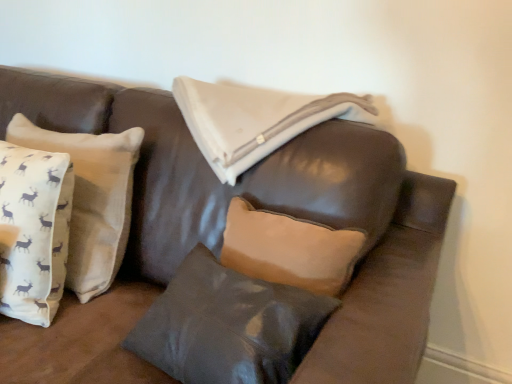
Question: Does matte gray pillow at center, arranged as the second pillow when viewed from the left, have a smaller size compared to white cotton cushion at left, the first pillow from the left?

Choices:
 (A) no
 (B) yes

Answer: (B)

Question: Does matte gray pillow at center, arranged as the second pillow when viewed from the left, have a lesser width compared to white cotton cushion at left, which ranks as the 2th pillow in right-to-left order?

Choices:
 (A) no
 (B) yes

Answer: (A)

Question: Is white cotton cushion at left, the first pillow from the left, a part of matte gray pillow at center, arranged as the second pillow when viewed from the left?

Choices:
 (A) yes
 (B) no

Answer: (B)

Question: Is matte gray pillow at center, arranged as the second pillow when viewed from the left, bigger than white cotton cushion at left, which ranks as the 2th pillow in right-to-left order?

Choices:
 (A) no
 (B) yes

Answer: (A)

Question: Does matte gray pillow at center, arranged as the second pillow when viewed from the left, come in front of white cotton cushion at left, which ranks as the 2th pillow in right-to-left order?

Choices:
 (A) no
 (B) yes

Answer: (B)

Question: Considering the relative sizes of matte gray pillow at center, arranged as the second pillow when viewed from the left, and white cotton cushion at left, the first pillow from the left, in the image provided, is matte gray pillow at center, arranged as the second pillow when viewed from the left, wider than white cotton cushion at left, the first pillow from the left,?

Choices:
 (A) no
 (B) yes

Answer: (B)

Question: Can you confirm if white cotton cushion at left, which ranks as the 2th pillow in right-to-left order, is positioned to the right of matte gray pillow at center, acting as the 1th pillow starting from the right?

Choices:
 (A) no
 (B) yes

Answer: (A)

Question: From a real-world perspective, is white cotton cushion at left, which ranks as the 2th pillow in right-to-left order, over matte gray pillow at center, acting as the 1th pillow starting from the right?

Choices:
 (A) no
 (B) yes

Answer: (B)

Question: Is white cotton cushion at left, which ranks as the 2th pillow in right-to-left order, shorter than matte gray pillow at center, acting as the 1th pillow starting from the right?

Choices:
 (A) yes
 (B) no

Answer: (B)

Question: Considering the relative sizes of white cotton cushion at left, which ranks as the 2th pillow in right-to-left order, and matte gray pillow at center, arranged as the second pillow when viewed from the left, in the image provided, is white cotton cushion at left, which ranks as the 2th pillow in right-to-left order, wider than matte gray pillow at center, arranged as the second pillow when viewed from the left,?

Choices:
 (A) yes
 (B) no

Answer: (B)

Question: From a real-world perspective, is white cotton cushion at left, the first pillow from the left, beneath matte gray pillow at center, acting as the 1th pillow starting from the right?

Choices:
 (A) no
 (B) yes

Answer: (A)

Question: From the image's perspective, is white cotton cushion at left, which ranks as the 2th pillow in right-to-left order, on matte gray pillow at center, arranged as the second pillow when viewed from the left?

Choices:
 (A) yes
 (B) no

Answer: (A)

Question: Considering the positions of point (32, 135) and point (279, 379), is point (32, 135) closer or farther from the camera than point (279, 379)?

Choices:
 (A) closer
 (B) farther

Answer: (B)